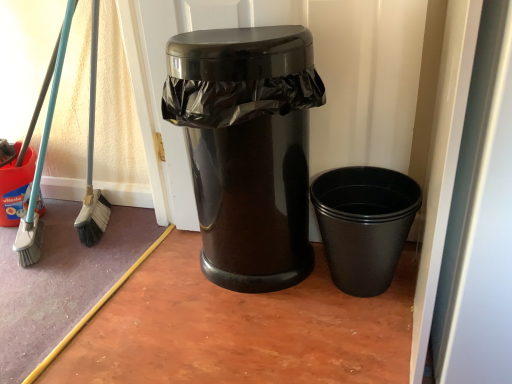
Question: Does black plastic cup at lower right, acting as the 2th waste container starting from the left, contain glossy black trash can at center, the 1th waste container in the left-to-right sequence?

Choices:
 (A) no
 (B) yes

Answer: (A)

Question: Is there a large distance between black plastic cup at lower right, acting as the 2th waste container starting from the left, and glossy black trash can at center, the 1th waste container in the left-to-right sequence?

Choices:
 (A) yes
 (B) no

Answer: (B)

Question: Can you confirm if black plastic cup at lower right, positioned as the 1th waste container in right-to-left order, is wider than glossy black trash can at center, arranged as the second waste container when viewed from the right?

Choices:
 (A) no
 (B) yes

Answer: (B)

Question: From a real-world perspective, is black plastic cup at lower right, acting as the 2th waste container starting from the left, on top of glossy black trash can at center, arranged as the second waste container when viewed from the right?

Choices:
 (A) no
 (B) yes

Answer: (A)

Question: Considering the relative positions of black plastic cup at lower right, acting as the 2th waste container starting from the left, and glossy black trash can at center, the 1th waste container in the left-to-right sequence, in the image provided, is black plastic cup at lower right, acting as the 2th waste container starting from the left, to the left of glossy black trash can at center, the 1th waste container in the left-to-right sequence, from the viewer's perspective?

Choices:
 (A) yes
 (B) no

Answer: (B)

Question: In the image, is black plastic cup at lower right, acting as the 2th waste container starting from the left, positioned in front of or behind glossy plastic trash can at center?

Choices:
 (A) behind
 (B) front

Answer: (B)

Question: Is black plastic cup at lower right, positioned as the 1th waste container in right-to-left order, to the left or to the right of glossy plastic trash can at center in the image?

Choices:
 (A) right
 (B) left

Answer: (A)

Question: From a real-world perspective, relative to glossy plastic trash can at center, is black plastic cup at lower right, positioned as the 1th waste container in right-to-left order, vertically above or below?

Choices:
 (A) above
 (B) below

Answer: (B)

Question: Is point [x=378, y=195] closer or farther from the camera than point [x=386, y=109]?

Choices:
 (A) closer
 (B) farther

Answer: (B)

Question: Is glossy black trash can at center, the 1th waste container in the left-to-right sequence, in front of or behind black plastic cup at lower right, positioned as the 1th waste container in right-to-left order, in the image?

Choices:
 (A) front
 (B) behind

Answer: (A)

Question: From the image's perspective, is glossy black trash can at center, arranged as the second waste container when viewed from the right, located above or below black plastic cup at lower right, acting as the 2th waste container starting from the left?

Choices:
 (A) above
 (B) below

Answer: (A)

Question: Based on their sizes in the image, would you say glossy black trash can at center, the 1th waste container in the left-to-right sequence, is bigger or smaller than black plastic cup at lower right, acting as the 2th waste container starting from the left?

Choices:
 (A) big
 (B) small

Answer: (A)

Question: Is glossy black trash can at center, the 1th waste container in the left-to-right sequence, wider or thinner than black plastic cup at lower right, acting as the 2th waste container starting from the left?

Choices:
 (A) thin
 (B) wide

Answer: (A)

Question: From a real-world perspective, is black plastic cup at lower right, positioned as the 1th waste container in right-to-left order, above or below glossy black trash can at center, the 1th waste container in the left-to-right sequence?

Choices:
 (A) below
 (B) above

Answer: (A)

Question: Choose the correct answer: Is black plastic cup at lower right, positioned as the 1th waste container in right-to-left order, inside glossy black trash can at center, arranged as the second waste container when viewed from the right, or outside it?

Choices:
 (A) inside
 (B) outside

Answer: (B)